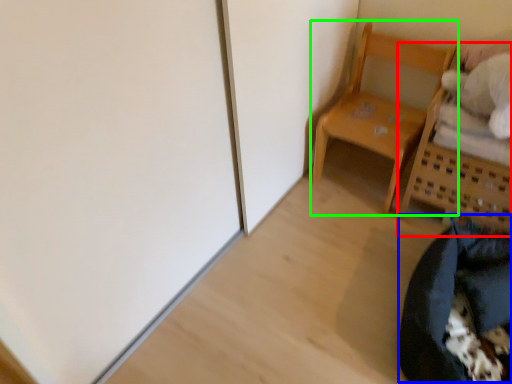
Question: Which object is the closest to the furniture (highlighted by a red box)? Choose among these: bean bag chair (highlighted by a blue box) or furniture (highlighted by a green box).

Choices:
 (A) bean bag chair
 (B) furniture

Answer: (B)